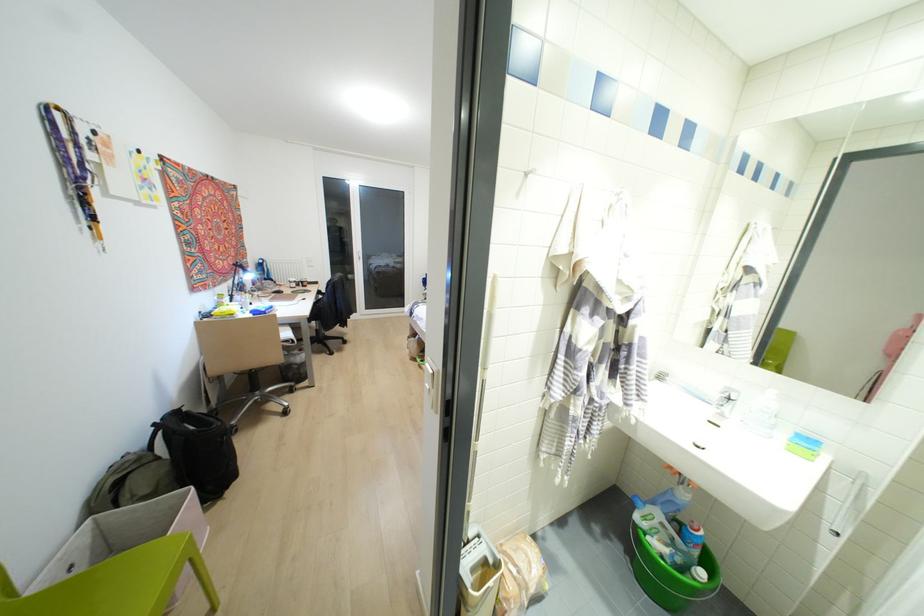
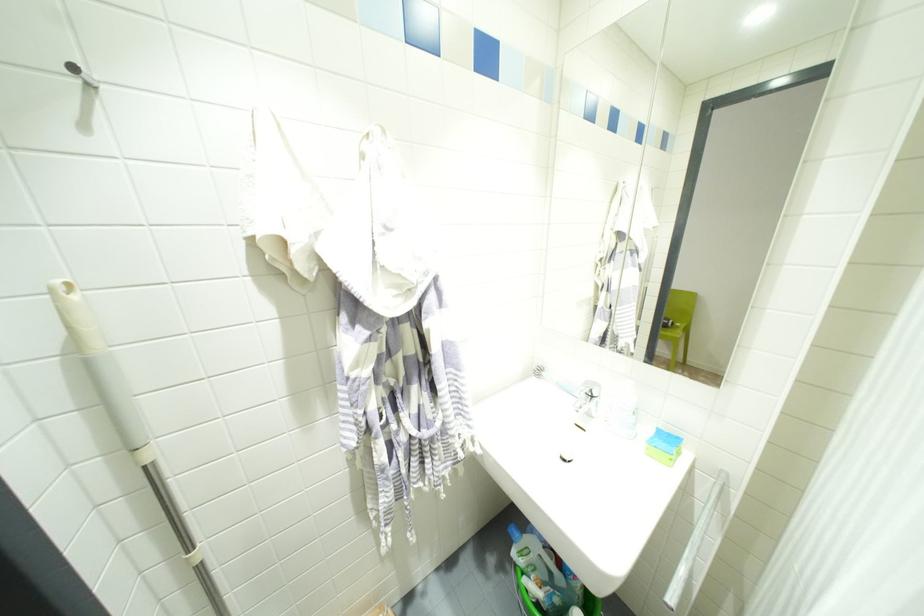
Where in the second image is the point corresponding to the point at 636,517 from the first image?

(513, 553)